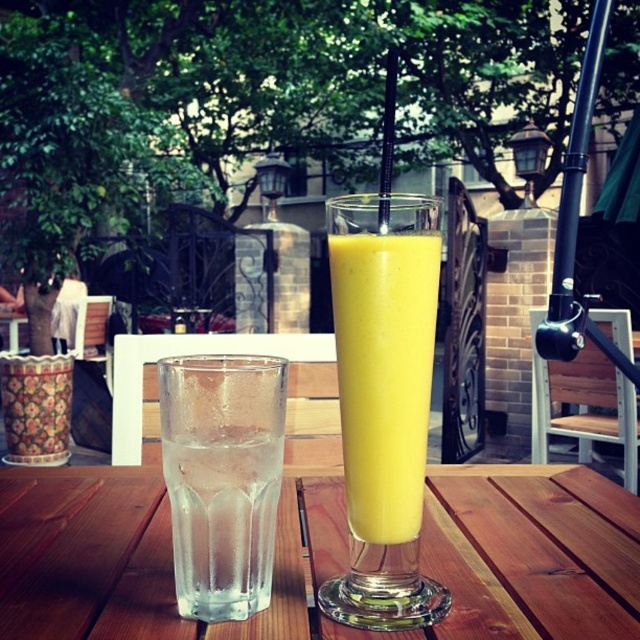
You are at the outdoor cafe and want to pour more water into the transparent glass at center. Can you do that without spilling, considering the size of the glass compared to the yellow smoothie at center?

The transparent glass at center is bigger than the yellow smoothie at center, so there is enough space to pour more water into the transparent glass at center without spilling.

You are at the outdoor cafe and want to walk from the wooden table to the decorative metal gate. There are two points marked on the path. The first point is at coordinate point (3, 572) and the second is at point (275, 451). Which point should you step on first to reach the gate?

You should step on point (275, 451) first because point (3, 572) is behind it, meaning point (275, 451) is closer to your starting position at the wooden table.

You are at the outdoor cafe and want to know which glass is taller. You see the clear glass at left and the yellow smoothie at center. Which one is taller?

The yellow smoothie at center is taller than the clear glass at left.